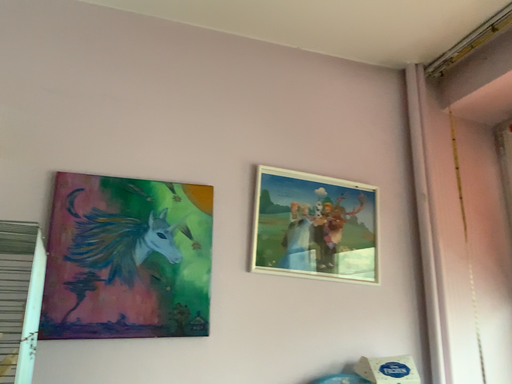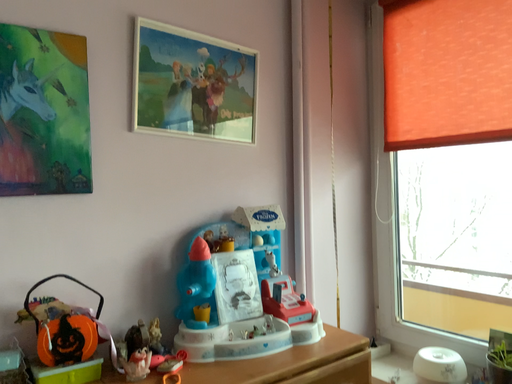
Question: How did the camera likely rotate when shooting the video?

Choices:
 (A) rotated downward
 (B) rotated upward

Answer: (A)